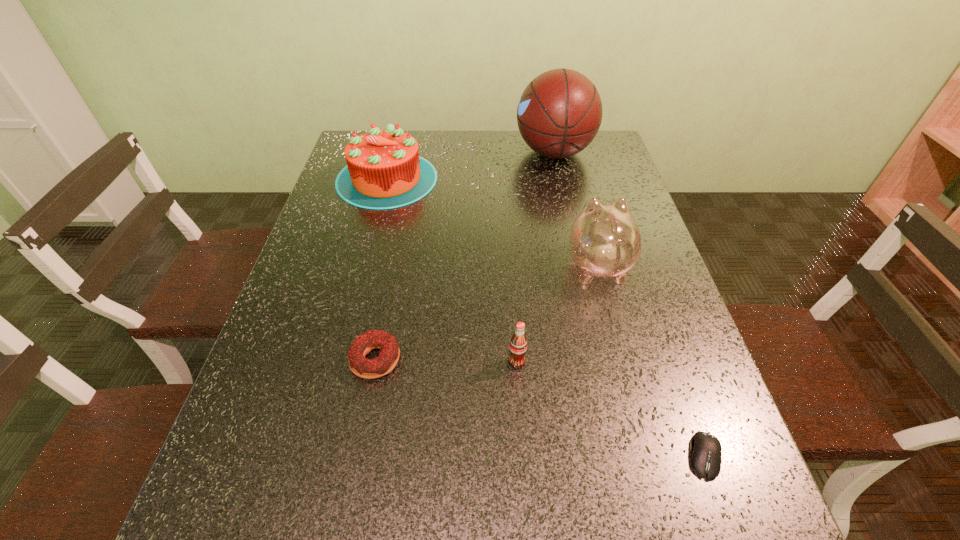
Where is `free space that is in between the basketball and the third farthest object`? free space that is in between the basketball and the third farthest object is located at coordinates (576, 208).

Locate an element on the screen. The height and width of the screenshot is (540, 960). vacant area that lies between the soda and the third farthest object is located at coordinates (558, 313).

Identify the location of unoccupied position between the doughnut and the cake. (381, 269).

At what (x,y) coordinates should I click in order to perform the action: click on unoccupied area between the cake and the piggy bank. Please return your answer as a coordinate pair (x, y). The height and width of the screenshot is (540, 960). Looking at the image, I should click on (492, 221).

You are a GUI agent. You are given a task and a screenshot of the screen. Output one action in this format:
    pyautogui.click(x=<x>, y=<y>)
    Task: Click on the free spot between the basketball and the cake
    
    Given the screenshot: What is the action you would take?
    pyautogui.click(x=470, y=166)

This screenshot has width=960, height=540. Identify the location of blank region between the fourth object from right to left and the basketball. (536, 257).

Where is `free space between the shortest object and the fourth object from right to left`? free space between the shortest object and the fourth object from right to left is located at coordinates (611, 409).

Identify the location of free space between the basketball and the cake. The height and width of the screenshot is (540, 960). (470, 166).

This screenshot has height=540, width=960. Find the location of `vacant area that lies between the piggy bank and the basketball`. vacant area that lies between the piggy bank and the basketball is located at coordinates (576, 208).

Identify which object is located as the nearest to the second shortest object. Please provide its 2D coordinates. Your answer should be formatted as a tuple, i.e. [(x, y)], where the tuple contains the x and y coordinates of a point satisfying the conditions above.

[(518, 343)]